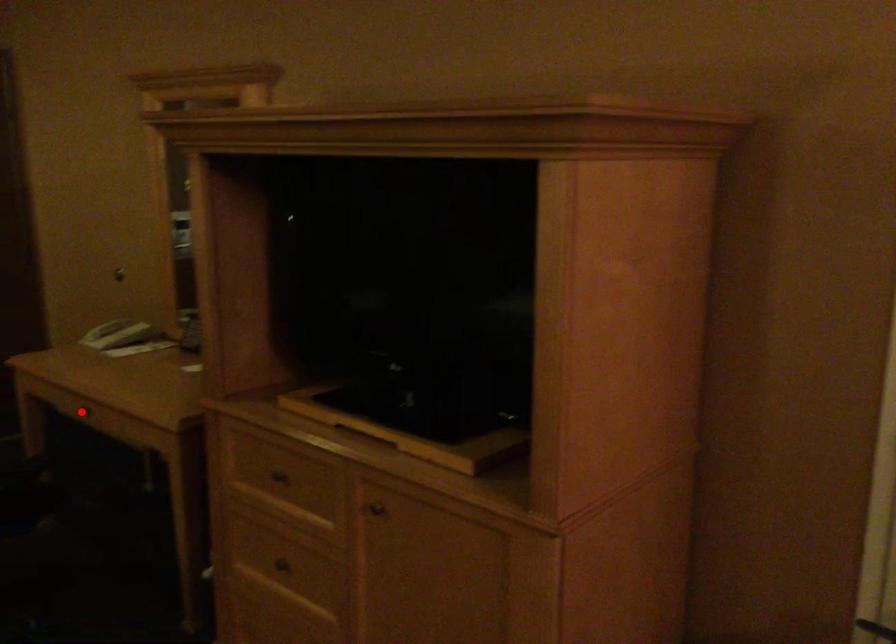
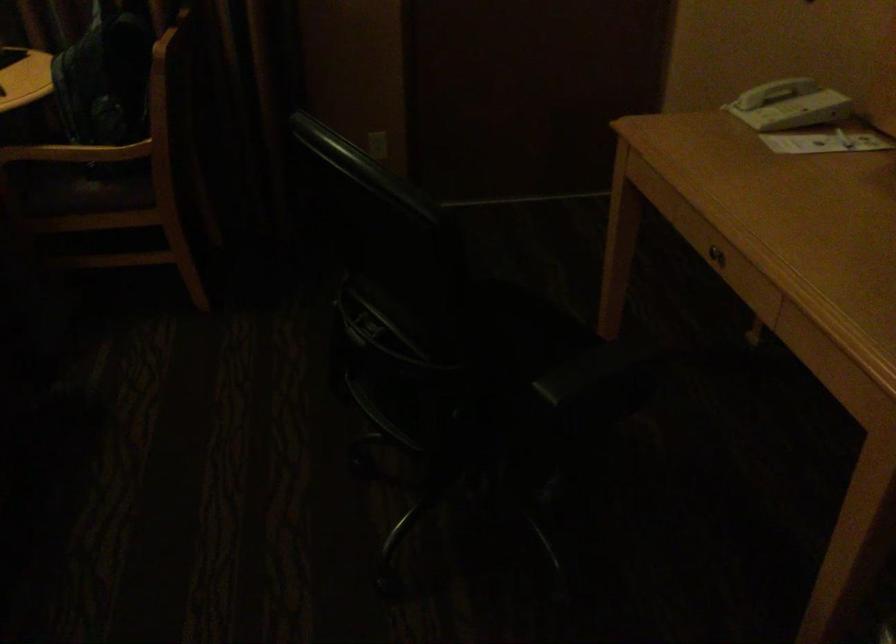
Question: I am providing you with two images of the same scene from different viewpoints. In image1, a red point is highlighted. Considering the same 3D point in image2, which of the following is correct?

Choices:
 (A) It is closer
 (B) It is farther

Answer: (A)